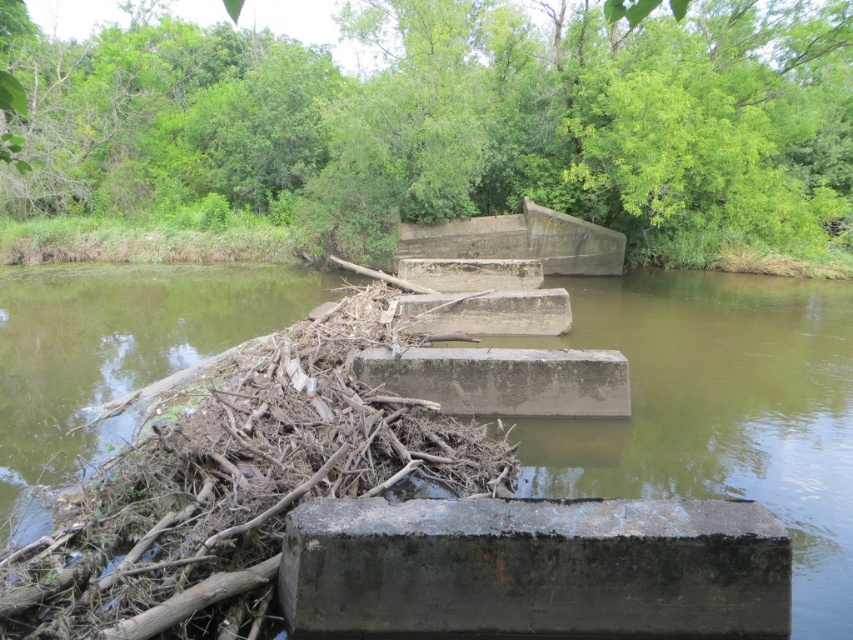
Is concrete blocks at center positioned behind gray concrete block at center?

No.

Does point (28, 385) lie behind point (450, 401)?

Yes, point (28, 385) is behind point (450, 401).

Image resolution: width=853 pixels, height=640 pixels. In order to click on concrete blocks at center in this screenshot , I will do `click(717, 410)`.

Is dark gray concrete block at center positioned at the back of gray concrete block at center?

No, dark gray concrete block at center is closer to the viewer.

Who is higher up, dark gray concrete block at center or gray concrete block at center?

gray concrete block at center

Which is in front, point (619, 579) or point (521, 400)?

Positioned in front is point (619, 579).

Locate an element on the screen. Image resolution: width=853 pixels, height=640 pixels. dark gray concrete block at center is located at coordinates (535, 566).

Is concrete blocks at center to the right of dark gray concrete block at center from the viewer's perspective?

Yes, concrete blocks at center is to the right of dark gray concrete block at center.

Can you confirm if concrete blocks at center is taller than dark gray concrete block at center?

Yes, concrete blocks at center is taller than dark gray concrete block at center.

Is point (148, 296) closer to viewer compared to point (569, 522)?

That is False.

Locate an element on the screen. concrete blocks at center is located at coordinates (717, 410).